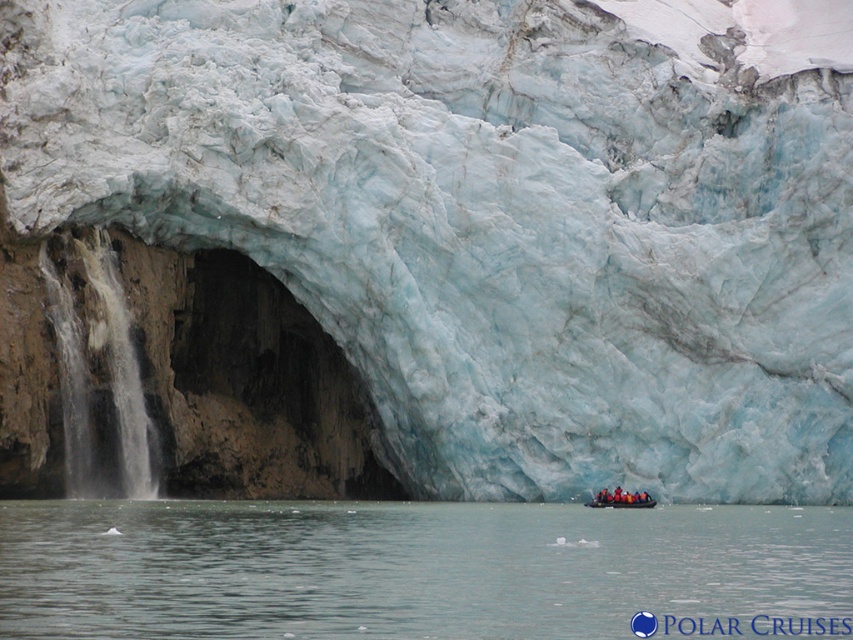
Question: Which is farther from the clear water at lower center?

Choices:
 (A) rubberized yellow boat at lower center
 (B) white frothy water at left

Answer: (A)

Question: Does clear water at lower center have a smaller size compared to rubberized yellow boat at lower center?

Choices:
 (A) yes
 (B) no

Answer: (B)

Question: Does clear water at lower center have a larger size compared to white frothy water at left?

Choices:
 (A) no
 (B) yes

Answer: (B)

Question: Can you confirm if white frothy water at left is smaller than rubberized yellow boat at lower center?

Choices:
 (A) yes
 (B) no

Answer: (B)

Question: Among these objects, which one is farthest from the camera?

Choices:
 (A) rubberized yellow boat at lower center
 (B) white frothy water at left

Answer: (A)

Question: Among these objects, which one is nearest to the camera?

Choices:
 (A) white frothy water at left
 (B) clear water at lower center
 (C) rubberized yellow boat at lower center

Answer: (B)